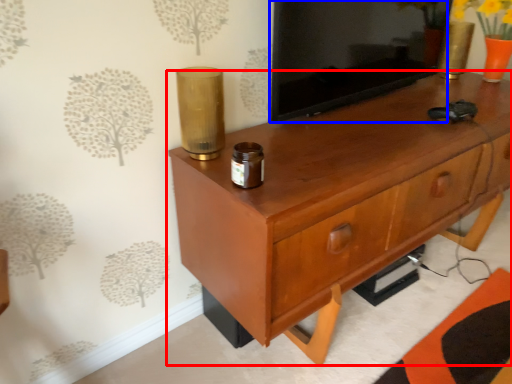
Question: Which object is closer to the camera taking this photo, chest of drawers (highlighted by a red box) or tv cabinet (highlighted by a blue box)?

Choices:
 (A) chest of drawers
 (B) tv cabinet

Answer: (A)